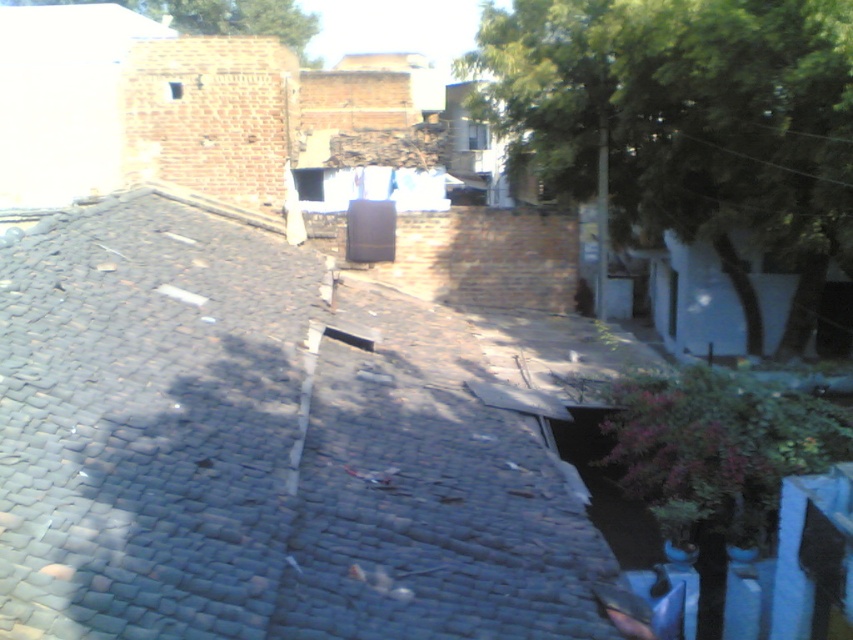
You are a painter standing on the rooftop and need to decide which object to paint first. The dark gray shingles at center and the green leafy tree at upper center are both in your view. Which object should you paint first if you want to start with the one that is closer to you?

The dark gray shingles at center should be painted first since they are closer to you than the green leafy tree at upper center.

Consider the image. You are standing on the rooftop and want to take a photo of the green leafy tree at upper right. If your camera has a maximum focus range of 10 meters, will it be able to capture the tree clearly?

The green leafy tree at upper right is 10.03 meters away from the camera. Since the camera can only focus up to 10 meters, it will not be able to capture the tree clearly.